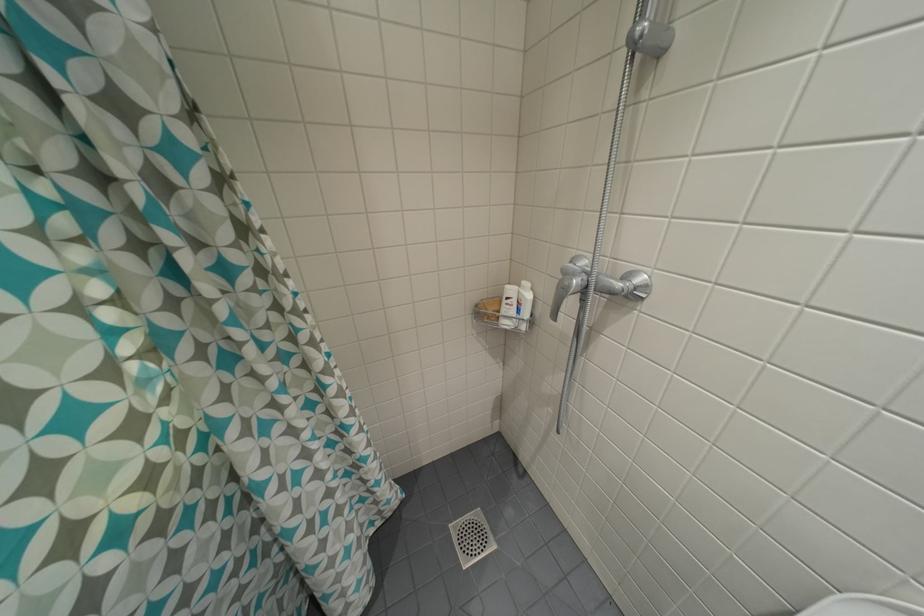
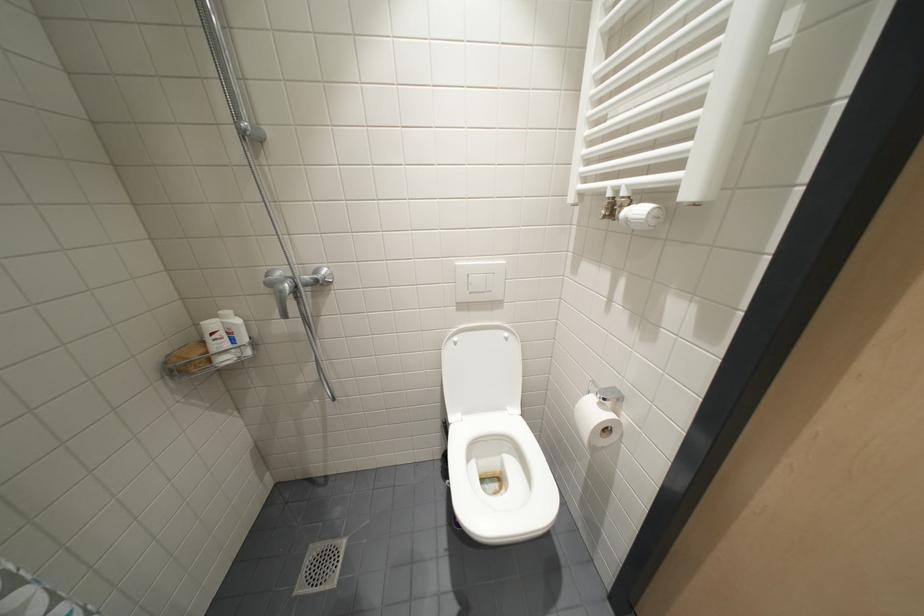
Question: The first image is from the beginning of the video and the second image is from the end. How did the camera likely rotate when shooting the video?

Choices:
 (A) Left
 (B) Right
 (C) Up
 (D) Down

Answer: (B)